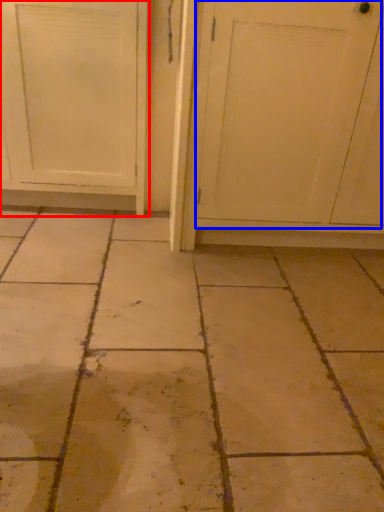
Question: Which of the following is the closest to the observer, door (highlighted by a red box) or screen door (highlighted by a blue box)?

Choices:
 (A) door
 (B) screen door

Answer: (B)